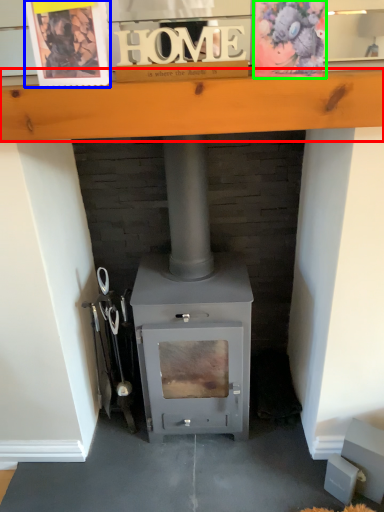
Question: Which is nearer to the ledge (highlighted by a red box)? postcard (highlighted by a blue box) or postcard (highlighted by a green box).

Choices:
 (A) postcard
 (B) postcard

Answer: (A)